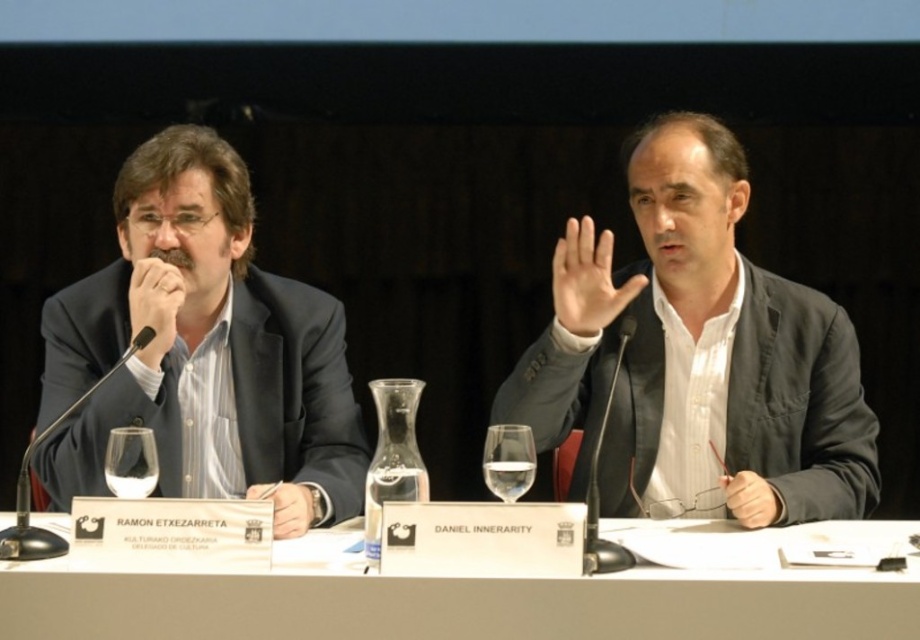
Is matte gray suit at right above clear glass wine glass at center?

Indeed, matte gray suit at right is positioned over clear glass wine glass at center.

Which is above, matte gray suit at right or clear glass wine glass at center?

Positioned higher is matte gray suit at right.

Is point (562, 272) closer to viewer compared to point (113, 436)?

No.

Where is `matte gray suit at right`? Image resolution: width=920 pixels, height=640 pixels. matte gray suit at right is located at coordinates (696, 349).

Can you confirm if clear glass wine glass at center is thinner than matte black pen at center?

Indeed, clear glass wine glass at center has a lesser width compared to matte black pen at center.

Which is above, clear glass wine glass at center or matte black pen at center?

Positioned higher is clear glass wine glass at center.

Which is in front, point (110, 483) or point (267, 488)?

Point (110, 483) is more forward.

Identify the location of clear glass wine glass at center. (130, 461).

Between matte gray suit at right and matte black hand at center, which one is positioned higher?

matte black hand at center is above.

Which is in front, point (720, 326) or point (567, 316)?

Positioned in front is point (567, 316).

I want to click on matte gray suit at right, so click(x=696, y=349).